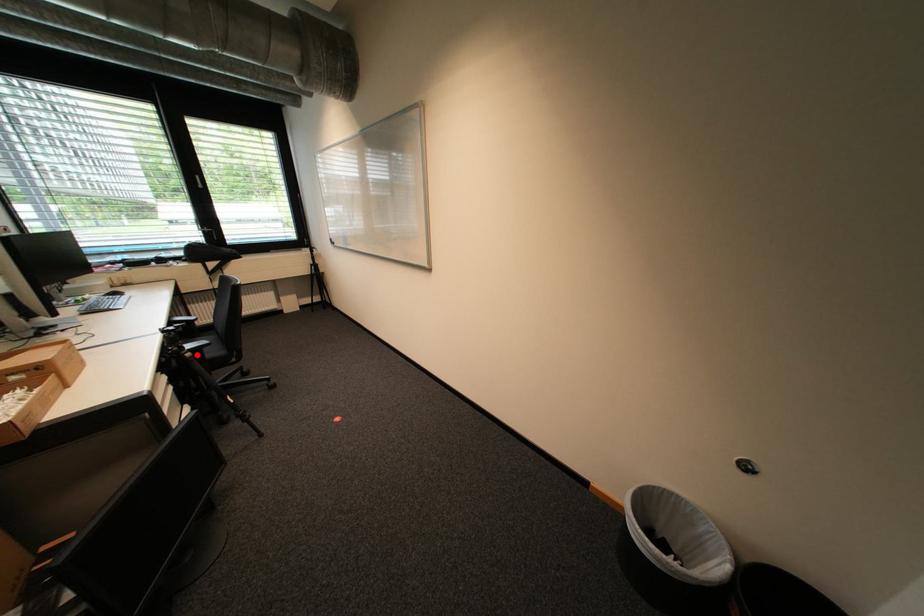
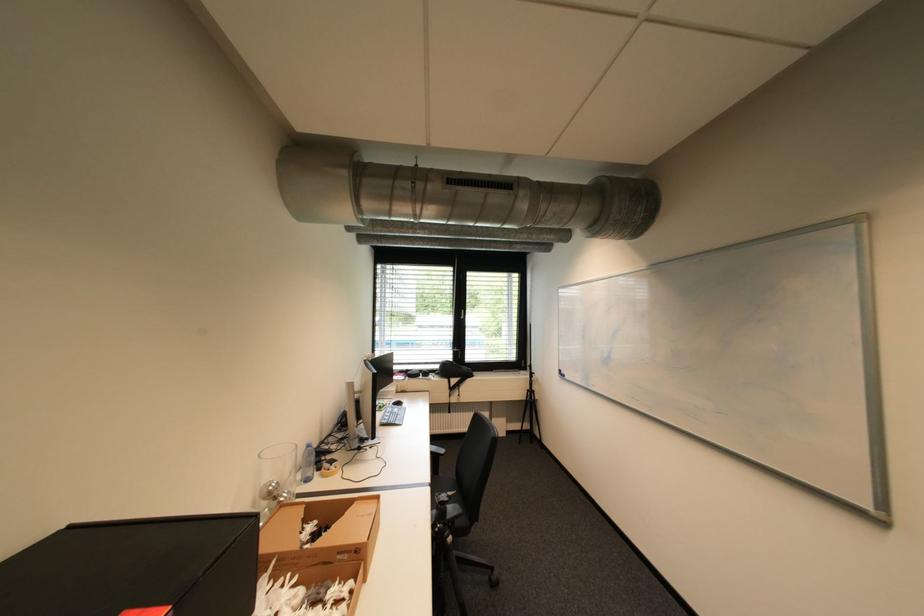
The point at the highlighted location is marked in the first image. Where is the corresponding point in the second image?

(458, 540)